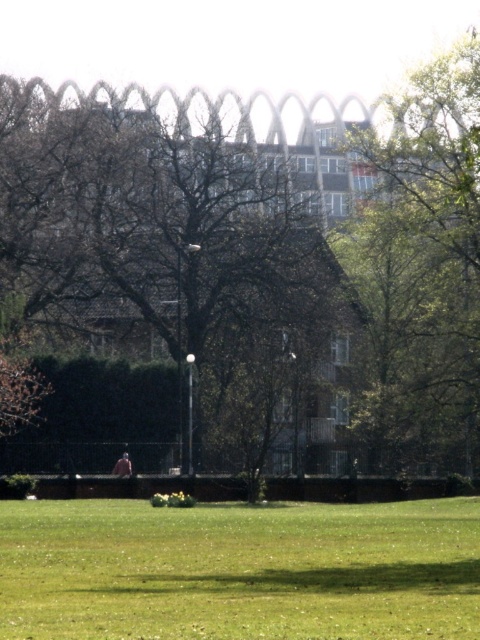
Question: Does green leafy tree at upper right appear under light brown fabric person at center?

Choices:
 (A) yes
 (B) no

Answer: (B)

Question: Among these points, which one is nearest to the camera?

Choices:
 (A) (91, 508)
 (B) (456, 237)

Answer: (A)

Question: Among these points, which one is farthest from the camera?

Choices:
 (A) (228, 529)
 (B) (121, 472)
 (C) (474, 250)

Answer: (C)

Question: Can you confirm if green grass at lower center is positioned below light brown fabric person at center?

Choices:
 (A) no
 (B) yes

Answer: (A)

Question: Which point is farther from the camera taking this photo?

Choices:
 (A) (432, 442)
 (B) (71, 525)
 (C) (115, 465)

Answer: (A)

Question: From the image, what is the correct spatial relationship of green leafy tree at upper right in relation to light brown fabric person at center?

Choices:
 (A) left
 (B) right

Answer: (B)